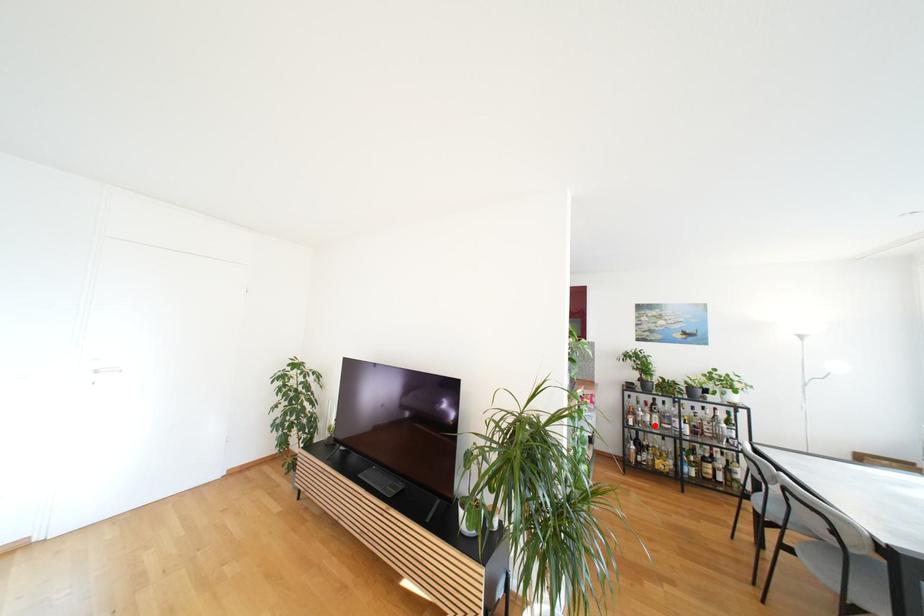
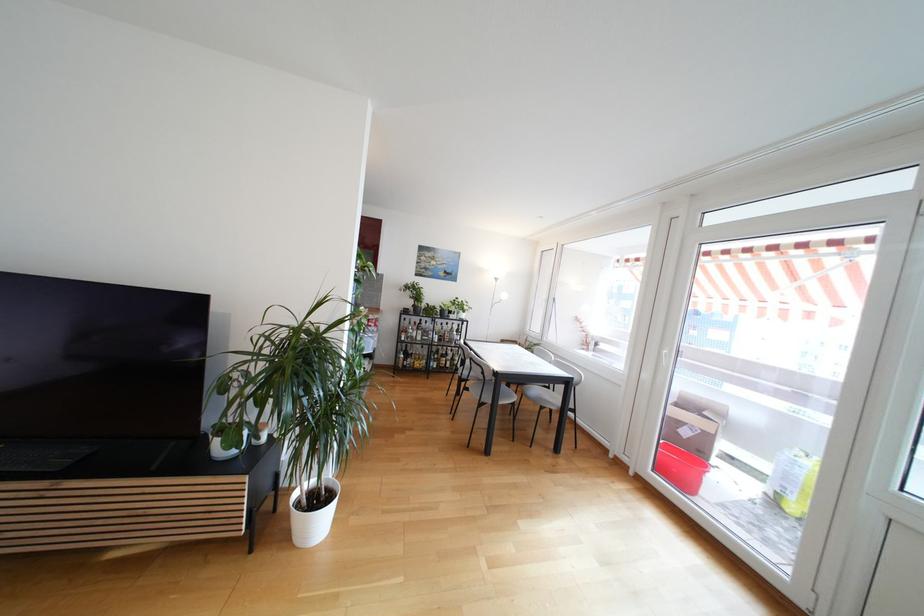
Find the pixel in the second image that matches the highlighted location in the first image.

(419, 339)